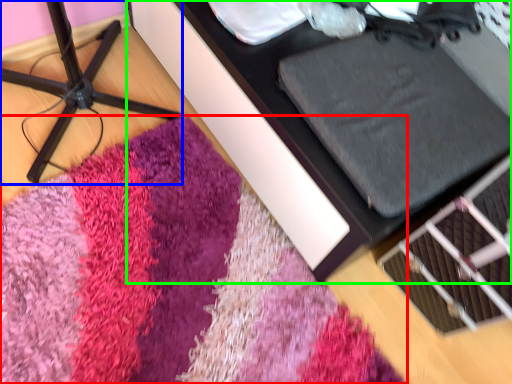
Question: Based on their relative distances, which object is nearer to mat (highlighted by a red box)? Choose from furniture (highlighted by a blue box) and furniture (highlighted by a green box).

Choices:
 (A) furniture
 (B) furniture

Answer: (B)